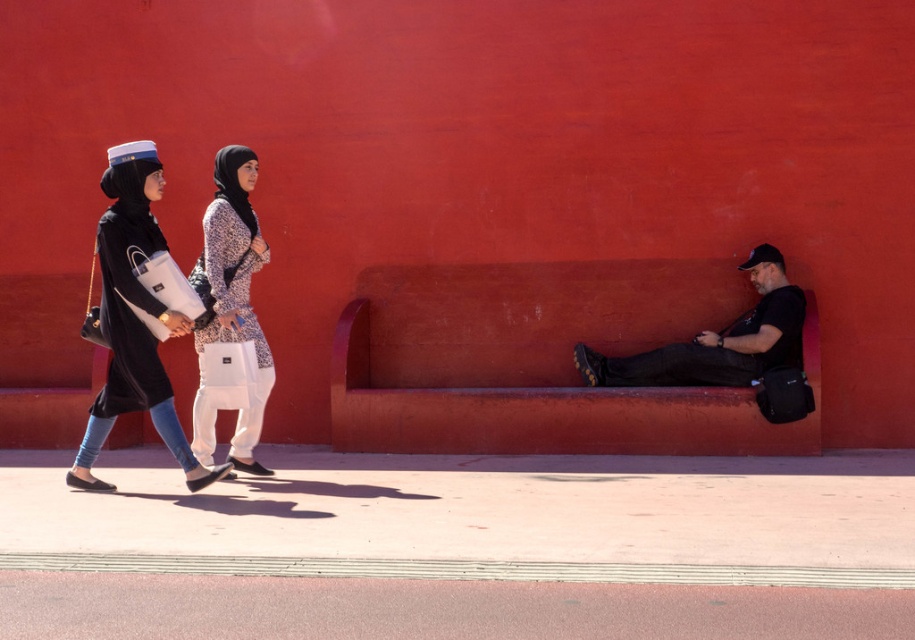
Between matte black dress at left and patterned fabric hijab at center, which one appears on the right side from the viewer's perspective?

From the viewer's perspective, patterned fabric hijab at center appears more on the right side.

Is matte black dress at left positioned behind patterned fabric hijab at center?

That is False.

Find the location of `matte black dress at left`. matte black dress at left is located at coordinates (133, 320).

Is pink rubber pavement at lower center to the right of matte black dress at left from the viewer's perspective?

Correct, you'll find pink rubber pavement at lower center to the right of matte black dress at left.

You are a GUI agent. You are given a task and a screenshot of the screen. Output one action in this format:
    pyautogui.click(x=<x>, y=<y>)
    Task: Click on the pink rubber pavement at lower center
    Image resolution: width=915 pixels, height=640 pixels.
    Given the screenshot: What is the action you would take?
    pyautogui.click(x=434, y=609)

What do you see at coordinates (434, 609) in the screenshot? The height and width of the screenshot is (640, 915). I see `pink rubber pavement at lower center` at bounding box center [434, 609].

Where is `pink rubber pavement at lower center`? pink rubber pavement at lower center is located at coordinates (434, 609).

Consider the image. Can you confirm if patterned fabric hijab at center is smaller than black matte shirt at center?

No.

Which is behind, point (221, 285) or point (651, 378)?

The point (651, 378) is more distant.

Where is `patterned fabric hijab at center`? Image resolution: width=915 pixels, height=640 pixels. patterned fabric hijab at center is located at coordinates (234, 289).

At what (x,y) coordinates should I click in order to perform the action: click on patterned fabric hijab at center. Please return your answer as a coordinate pair (x, y). Looking at the image, I should click on (234, 289).